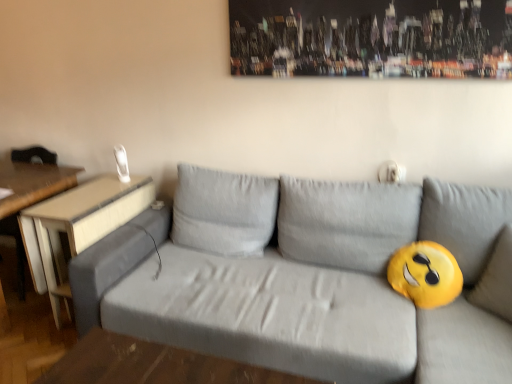
Question: Considering the relative sizes of gray fabric couch at center and wooden table at left, the 1th table when ordered from left to right, in the image provided, is gray fabric couch at center bigger than wooden table at left, the 1th table when ordered from left to right,?

Choices:
 (A) yes
 (B) no

Answer: (A)

Question: Is gray fabric couch at center aimed at wooden table at left, the 2th table in the right-to-left sequence?

Choices:
 (A) no
 (B) yes

Answer: (A)

Question: From the image's perspective, is gray fabric couch at center beneath wooden table at left, the 1th table when ordered from left to right?

Choices:
 (A) no
 (B) yes

Answer: (B)

Question: Would you say gray fabric couch at center is outside wooden table at left, the 2th table in the right-to-left sequence?

Choices:
 (A) yes
 (B) no

Answer: (A)

Question: From a real-world perspective, is gray fabric couch at center physically above wooden table at left, the 2th table in the right-to-left sequence?

Choices:
 (A) yes
 (B) no

Answer: (A)

Question: Relative to gray fabric couch at center, is wooden table at left, the 2th table in the right-to-left sequence, in front or behind?

Choices:
 (A) front
 (B) behind

Answer: (B)

Question: Is wooden table at left, the 1th table when ordered from left to right, wider or thinner than gray fabric couch at center?

Choices:
 (A) wide
 (B) thin

Answer: (B)

Question: Visually, is wooden table at left, the 1th table when ordered from left to right, positioned to the left or to the right of gray fabric couch at center?

Choices:
 (A) left
 (B) right

Answer: (A)

Question: From the image's perspective, is wooden table at left, the 2th table in the right-to-left sequence, above or below gray fabric couch at center?

Choices:
 (A) below
 (B) above

Answer: (B)

Question: From a real-world perspective, is light brown wood table at left, the first table when ordered from right to left, above or below gray fabric couch at center?

Choices:
 (A) above
 (B) below

Answer: (B)

Question: From the image's perspective, is light brown wood table at left, the first table when ordered from right to left, above or below gray fabric couch at center?

Choices:
 (A) above
 (B) below

Answer: (A)

Question: Considering the positions of light brown wood table at left, which is the 2th table in left-to-right order, and gray fabric couch at center in the image, is light brown wood table at left, which is the 2th table in left-to-right order, wider or thinner than gray fabric couch at center?

Choices:
 (A) wide
 (B) thin

Answer: (B)

Question: Is light brown wood table at left, which is the 2th table in left-to-right order, spatially inside gray fabric couch at center, or outside of it?

Choices:
 (A) inside
 (B) outside

Answer: (B)

Question: In terms of height, does gray fabric couch at center look taller or shorter compared to wooden table at left, the 1th table when ordered from left to right?

Choices:
 (A) tall
 (B) short

Answer: (A)

Question: Considering the relative positions of gray fabric couch at center and wooden table at left, the 2th table in the right-to-left sequence, in the image provided, is gray fabric couch at center to the left or to the right of wooden table at left, the 2th table in the right-to-left sequence,?

Choices:
 (A) left
 (B) right

Answer: (B)